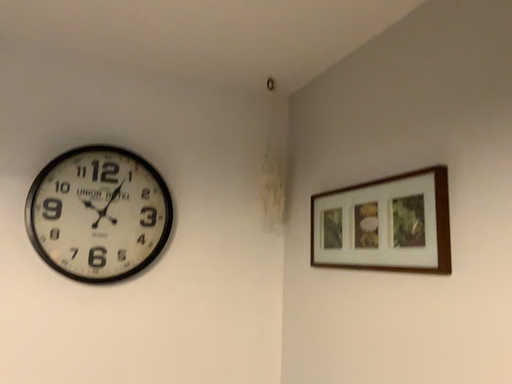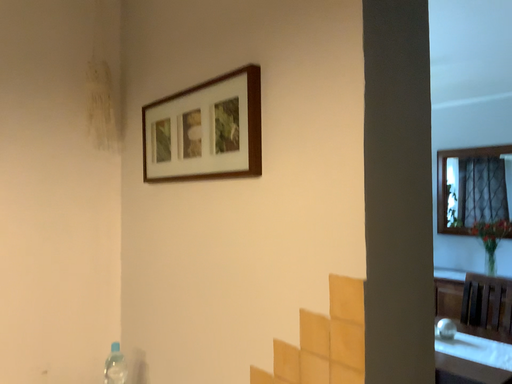
Question: How did the camera likely rotate when shooting the video?

Choices:
 (A) rotated left
 (B) rotated right

Answer: (B)